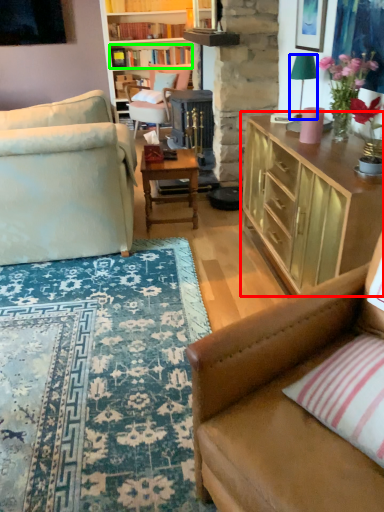
Question: Based on their relative distances, which object is nearer to cabinetry (highlighted by a red box)? Choose from lamp (highlighted by a blue box) and book (highlighted by a green box).

Choices:
 (A) lamp
 (B) book

Answer: (A)